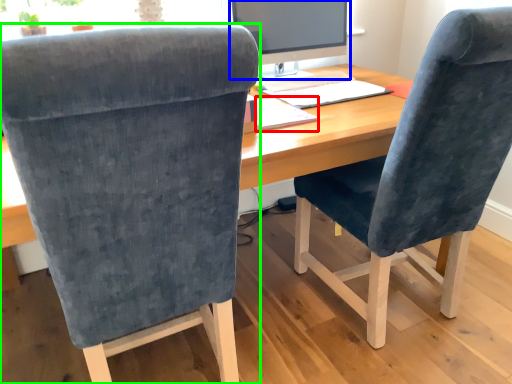
Question: Estimate the real-world distances between objects in this image. Which object is farther from notepad (highlighted by a red box), computer monitor (highlighted by a blue box) or chair (highlighted by a green box)?

Choices:
 (A) computer monitor
 (B) chair

Answer: (B)